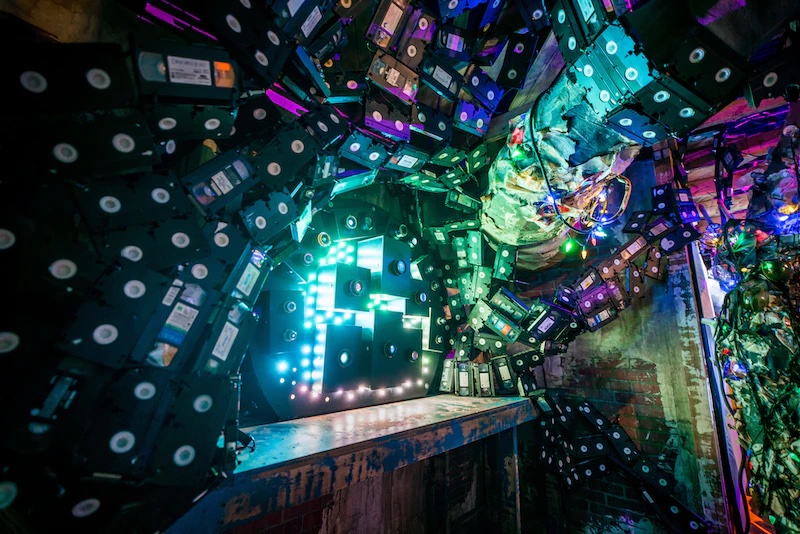
Image resolution: width=800 pixels, height=534 pixels. I want to click on black back board, so click(265, 374).